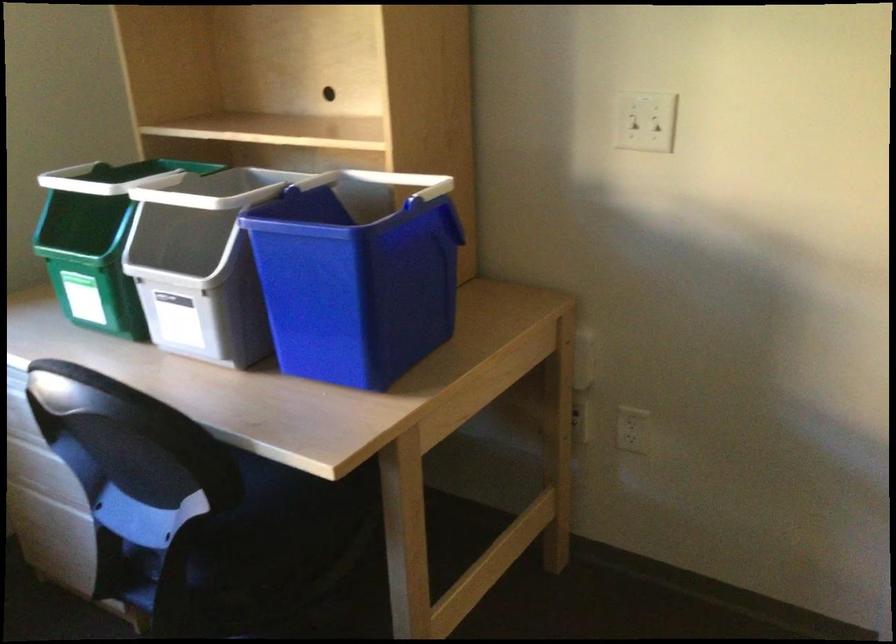
Find where to lift the green bin handle. Please return your answer as a coordinate pair (x, y).

(116, 178)